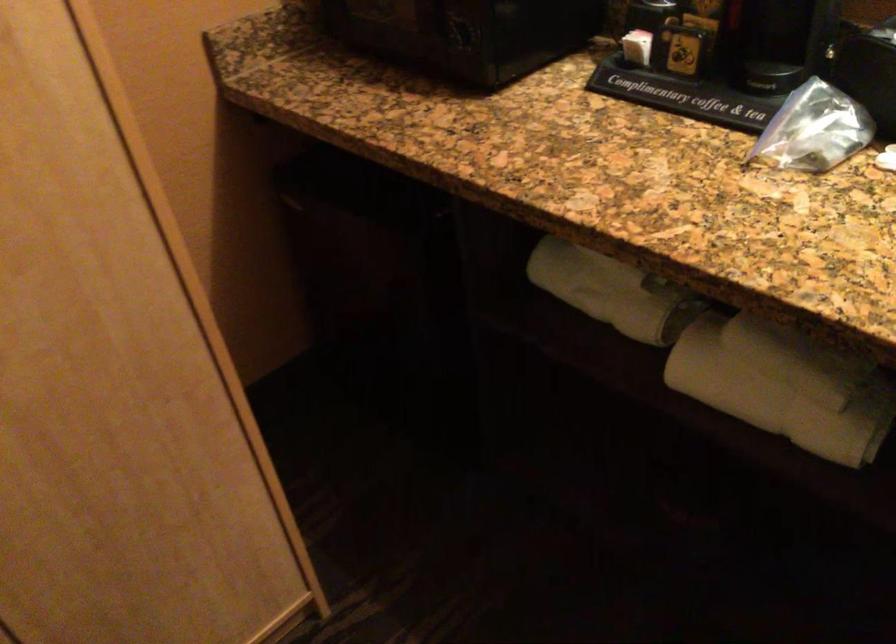
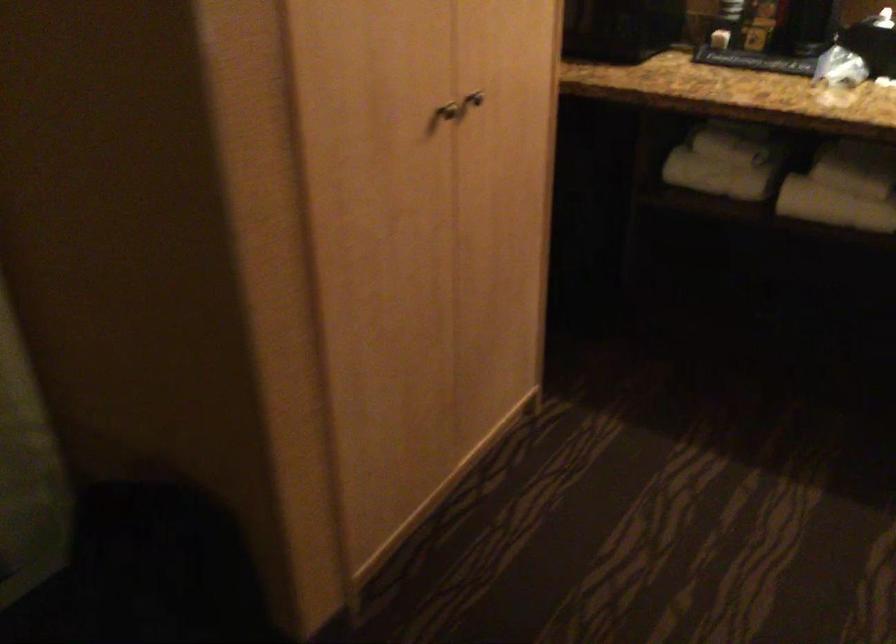
What movement of the cameraman would produce the second image?

The cameraman moved toward left, backward.